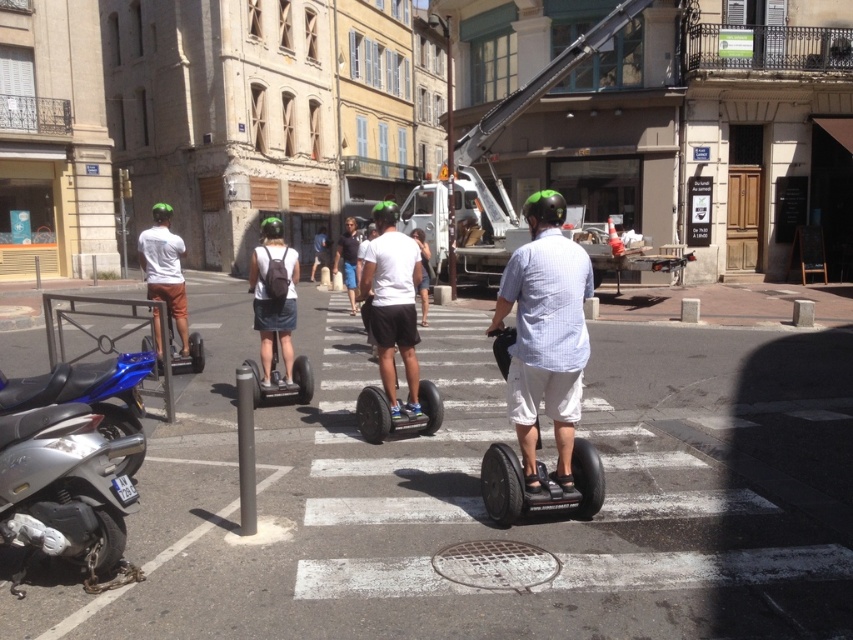
You are a delivery person who needs to park your 1.2 meter wide motorcycle in the street scene. You see the silver metallic motorcycle at lower left and the matte white shirt at left. Which object has enough width to accommodate your motorcycle?

The silver metallic motorcycle at lower left has a width less than the matte white shirt at left. Since your motorcycle is 1.2 meters wide, you need to check which object provides sufficient space. However, the description only compares their widths but does not provide exact measurements. Therefore, it is unclear which one can accommodate your motorcycle based on the given information.

You are a pedestrian standing on the sidewalk and see the light blue checkered shirt at center. There is a street vendor 5 meters away from you selling ice cream. Can you buy an ice cream from the vendor without crossing the street?

The light blue checkered shirt at center is 4.94 meters away from you. Since the vendor is only 5 meters away, you can reach the vendor before reaching the light blue checkered shirt at center and buy the ice cream without crossing the street.

You are a pedestrian standing on the sidewalk observing the black matte segway at center and the dark blue shorts at center. Which object is positioned more to the right from your viewpoint?

The black matte segway at center is positioned more to the right than the dark blue shorts at center from your viewpoint.